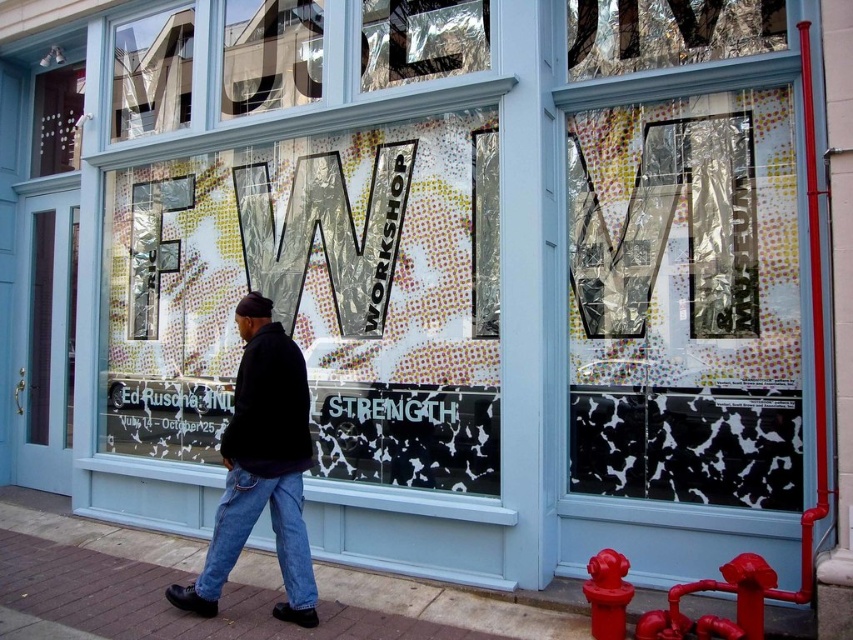
You are standing in front of the FW WORKSHOP storefront. You want to place a 3.5 meter long ladder between the metallic reflective foil at upper center and the shiny red fire hydrant at lower right. Can the ladder fit between them?

The metallic reflective foil at upper center is 2.92 meters away from the shiny red fire hydrant at lower right. Since the ladder is 3.5 meters long, which is longer than the distance between them, the ladder cannot fit between them.